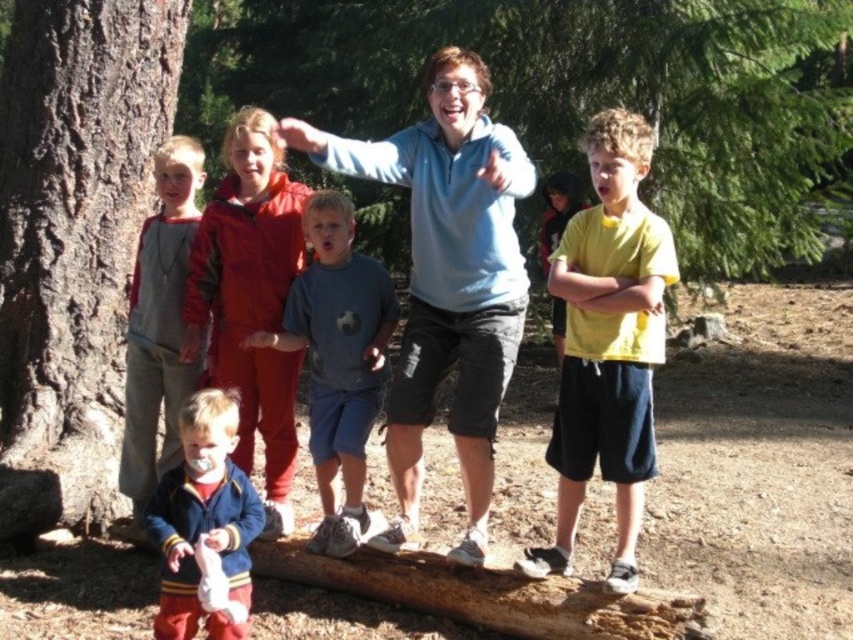
You are a photographer trying to capture a group photo of the velvet blue jacket at center and the velvet blue jacket at lower left. Since you want to ensure both are clearly visible, which jacket should you focus on first to avoid blurring due to size differences?

The velvet blue jacket at center is larger in size than the velvet blue jacket at lower left, so you should focus on the velvet blue jacket at center first to ensure clarity before adjusting for the smaller one.

You are organizing a group photo and need to ensure that the velvet blue jacket at center and the gray matte soccer ball at center can fit side by side within a 1.2 meter wide frame. Based on their sizes, will they both fit comfortably?

The velvet blue jacket at center is narrower than the gray matte soccer ball at center. However, since the total width of both items combined may exceed 1.2 meters, it is uncertain if they will fit comfortably without overlapping or crowding. Further measurements are needed.